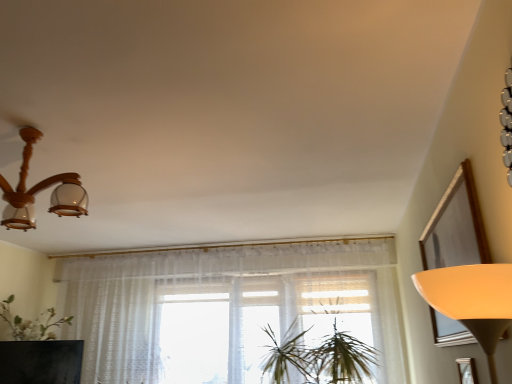
Question: Is green leafy plant at center touching sheer white curtain at center?

Choices:
 (A) yes
 (B) no

Answer: (B)

Question: Does green leafy plant at center contain sheer white curtain at center?

Choices:
 (A) no
 (B) yes

Answer: (A)

Question: Can you confirm if green leafy plant at center is wider than sheer white curtain at center?

Choices:
 (A) yes
 (B) no

Answer: (A)

Question: Is green leafy plant at center completely or partially outside of sheer white curtain at center?

Choices:
 (A) no
 (B) yes

Answer: (B)

Question: Is green leafy plant at center closer to the viewer compared to sheer white curtain at center?

Choices:
 (A) no
 (B) yes

Answer: (B)

Question: Does point (18, 223) appear closer or farther from the camera than point (280, 354)?

Choices:
 (A) farther
 (B) closer

Answer: (B)

Question: In terms of width, does wooden chandelier at upper left look wider or thinner when compared to green leafy plant at center?

Choices:
 (A) wide
 (B) thin

Answer: (B)

Question: From the image's perspective, is wooden chandelier at upper left positioned above or below green leafy plant at center?

Choices:
 (A) below
 (B) above

Answer: (B)

Question: In terms of height, does wooden chandelier at upper left look taller or shorter compared to green leafy plant at center?

Choices:
 (A) short
 (B) tall

Answer: (A)

Question: Relative to green leafy plant at center, is matte black tv at lower left in front or behind?

Choices:
 (A) front
 (B) behind

Answer: (B)

Question: From a real-world perspective, is matte black tv at lower left above or below green leafy plant at center?

Choices:
 (A) below
 (B) above

Answer: (A)

Question: From the image's perspective, is matte black tv at lower left above or below green leafy plant at center?

Choices:
 (A) above
 (B) below

Answer: (B)

Question: Do you think matte black tv at lower left is within green leafy plant at center, or outside of it?

Choices:
 (A) outside
 (B) inside

Answer: (A)

Question: Is sheer white curtain at center in front of or behind wooden chandelier at upper left in the image?

Choices:
 (A) behind
 (B) front

Answer: (A)

Question: Looking at their shapes, would you say sheer white curtain at center is wider or thinner than wooden chandelier at upper left?

Choices:
 (A) thin
 (B) wide

Answer: (A)